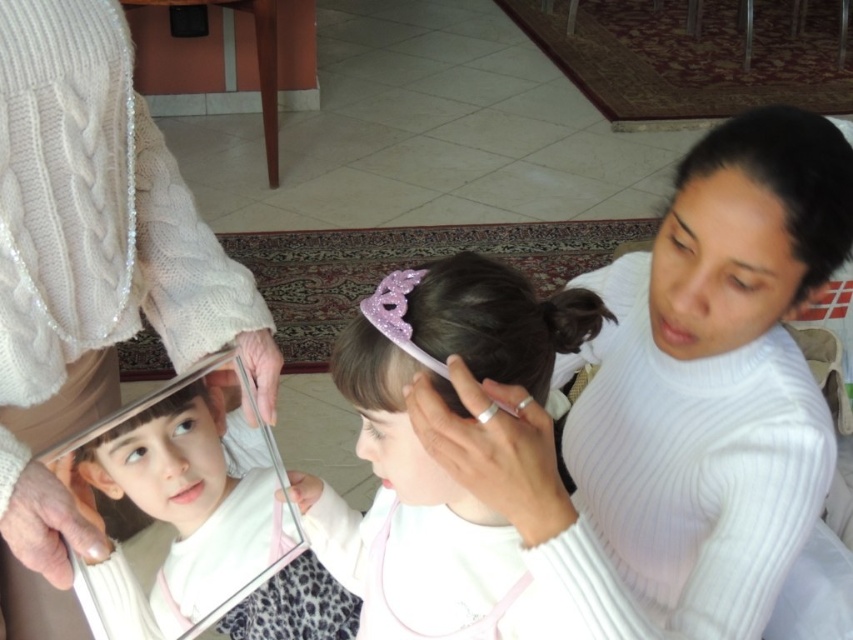
In the scene shown: Does white cable-knit sweater at upper left appear on the left side of silver metallic mirror at center?

Correct, you'll find white cable-knit sweater at upper left to the left of silver metallic mirror at center.

Does point (39, 19) come farther from viewer compared to point (158, 508)?

No.

This screenshot has height=640, width=853. Find the location of `white cable-knit sweater at upper left`. white cable-knit sweater at upper left is located at coordinates (90, 276).

Can you confirm if white cable-knit sweater at upper left is smaller than black shiny hair at upper right?

No.

Is white cable-knit sweater at upper left below black shiny hair at upper right?

Indeed, white cable-knit sweater at upper left is positioned under black shiny hair at upper right.

Does point (154, 221) come in front of point (751, 140)?

That is False.

Find the location of `white cable-knit sweater at upper left`. white cable-knit sweater at upper left is located at coordinates (90, 276).

Between white ribbed sweater at upper right and white cable-knit sweater at upper left, which one appears on the left side from the viewer's perspective?

From the viewer's perspective, white cable-knit sweater at upper left appears more on the left side.

Is point (643, 282) positioned behind point (74, 365)?

No, it is not.

What are the coordinates of `white ribbed sweater at upper right` in the screenshot? It's located at (682, 397).